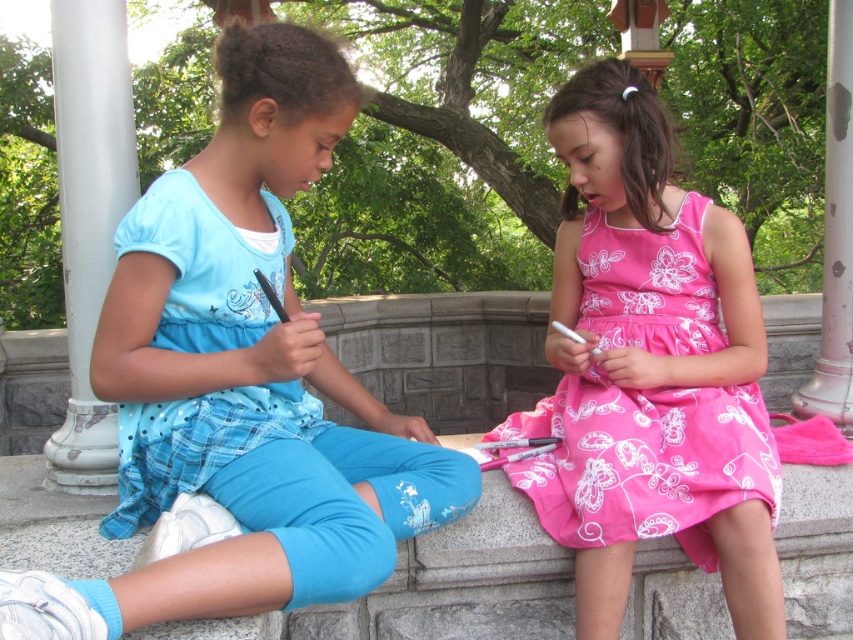
You are a photographer trying to capture a closeup shot of both the matte blue pants at center and the pink floral dress at center in the image. The camera you are using has a maximum focus range of 28 inches. Can you fit both subjects within the focus range?

The matte blue pants at center and pink floral dress at center are 28.53 inches apart. Since the distance between them exceeds the camera maximum focus range of 28 inches, you cannot fit both subjects within the focus range.

You are a photographer trying to capture both the matte blue pants at center and the pink floral dress at center in a single frame. Based on their widths, which object should you focus on to ensure both fit comfortably in the photo?

The matte blue pants at center is wider than the pink floral dress at center. To ensure both fit comfortably in the photo, focus on the wider matte blue pants at center as the primary subject, allowing space for the narrower pink floral dress at center.

From the picture: You are a photographer aiming to capture a closeup of the matte blue pants at center in the image. Given that the camera is positioned at the point with coordinates (242, 378), can you confirm if the pants are within the camera frame?

The point (242, 378) corresponds to the location of the matte blue pants at center, so yes, the camera is positioned directly at the point where the matte blue pants at center are located, ensuring they are centered in the frame.